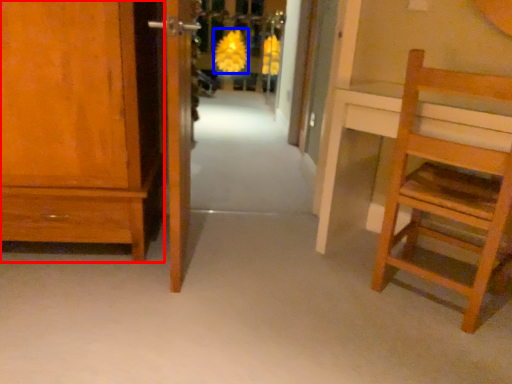
Question: Which point is closer to the camera, cabinetry (highlighted by a red box) or flower (highlighted by a blue box)?

Choices:
 (A) cabinetry
 (B) flower

Answer: (A)